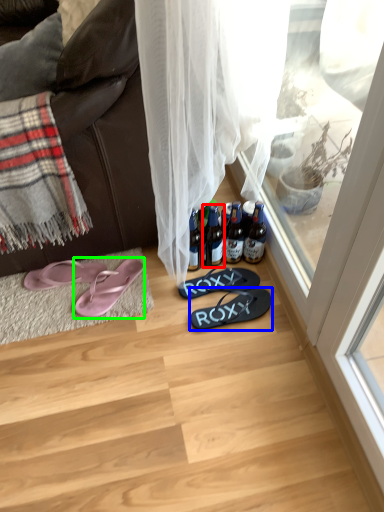
Question: Estimate the real-world distances between objects in this image. Which object is farther from bottle (highlighted by a red box), footwear (highlighted by a blue box) or footwear (highlighted by a green box)?

Choices:
 (A) footwear
 (B) footwear

Answer: (B)